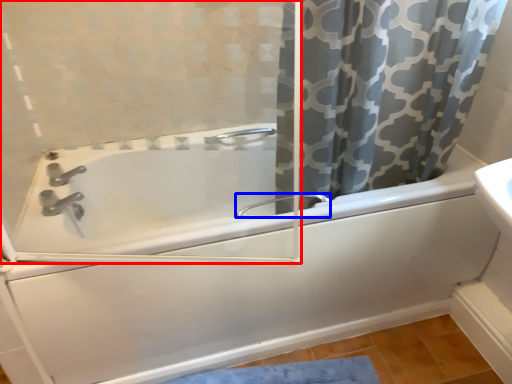
Question: Among these objects, which one is nearest to the camera, screen door (highlighted by a red box) or faucet (highlighted by a blue box)?

Choices:
 (A) screen door
 (B) faucet

Answer: (A)